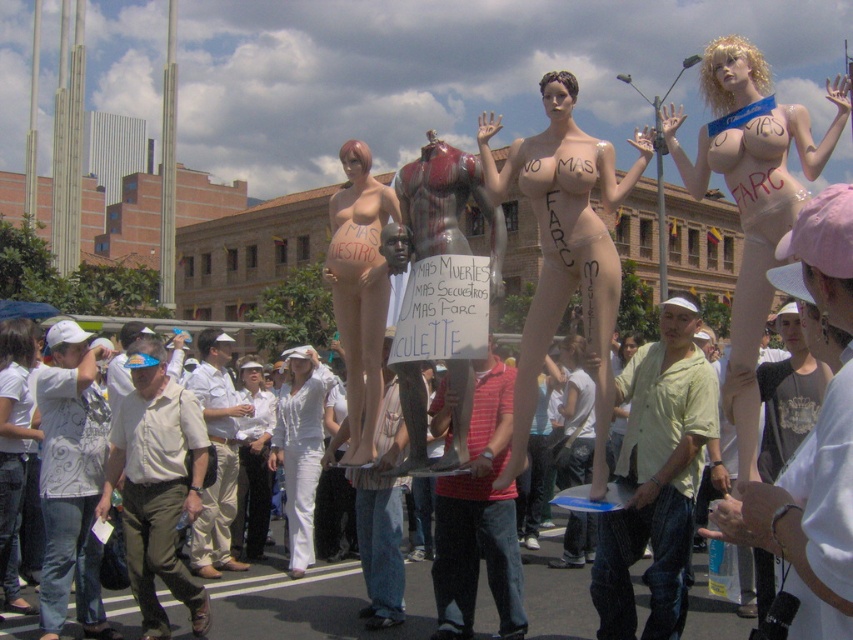
Question: Observing the image, what is the correct spatial positioning of matte flesh-colored mannequin at center in reference to white cotton shirt at lower left?

Choices:
 (A) right
 (B) left

Answer: (A)

Question: Which point is farther to the camera?

Choices:
 (A) white printed shirt at center
 (B) light yellow shirt at center
 (C) khaki cotton pants at lower left
 (D) matte black bikini top at center

Answer: (C)

Question: Is khaki cotton pants at lower left smaller than khaki cotton pants at center?

Choices:
 (A) yes
 (B) no

Answer: (B)

Question: Which of these objects is positioned closest to the white fabric dress at center?

Choices:
 (A) white cotton shirt at lower left
 (B) matte black bikini top at center
 (C) light yellow shirt at center
 (D) white fabric pants at center

Answer: (C)

Question: Which point is farther from the camera taking this photo?

Choices:
 (A) (618, 611)
 (B) (201, 552)
 (C) (582, 470)

Answer: (C)

Question: Does khaki cotton pants at center appear under white fabric dress at center?

Choices:
 (A) no
 (B) yes

Answer: (B)